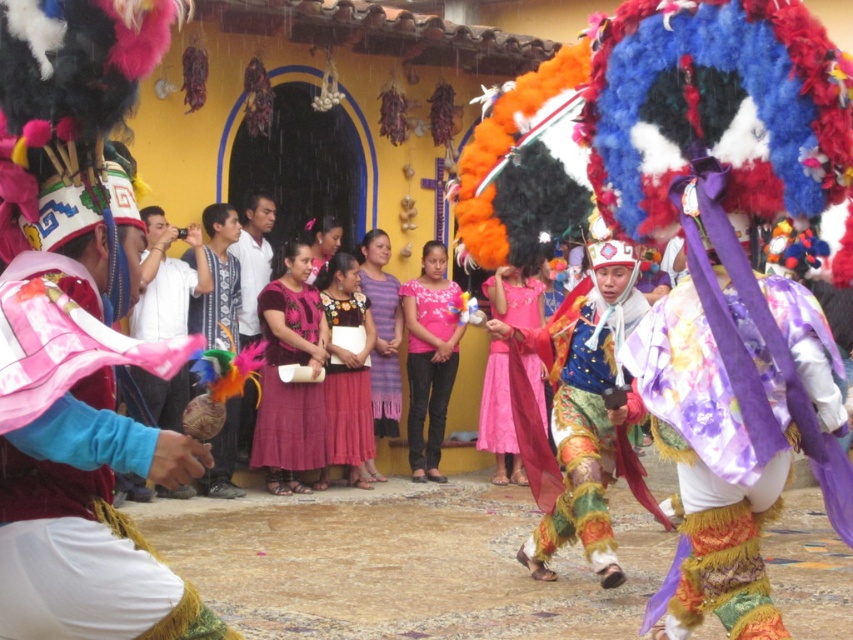
Question: Is floral silk skirt at center positioned in front of multicolored feathered headdress at center?

Choices:
 (A) no
 (B) yes

Answer: (B)

Question: Estimate the real-world distances between objects in this image. Which object is closer to the pink satin dress at center?

Choices:
 (A) white cotton shirt at center
 (B) embroidered fabric dress at center

Answer: (B)

Question: Which object is farther from the camera taking this photo?

Choices:
 (A) matte pink fabric at left
 (B) multicolored feathered headdress at center
 (C) multicolored fabric mask at center

Answer: (B)

Question: Which object is closer to the camera taking this photo?

Choices:
 (A) multicolored fabric mask at center
 (B) floral silk skirt at center
 (C) pink satin blouse at center
 (D) purple woven dress at center

Answer: (B)

Question: Does matte pink fabric at left appear on the right side of purple woven dress at center?

Choices:
 (A) yes
 (B) no

Answer: (A)

Question: Does multicolored feathered headdress at center appear on the right side of white cotton shirt at center?

Choices:
 (A) yes
 (B) no

Answer: (B)